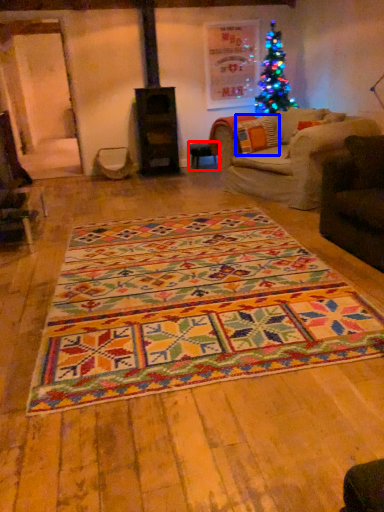
Question: Which object is closer to the camera taking this photo, table (highlighted by a red box) or pillow (highlighted by a blue box)?

Choices:
 (A) table
 (B) pillow

Answer: (B)